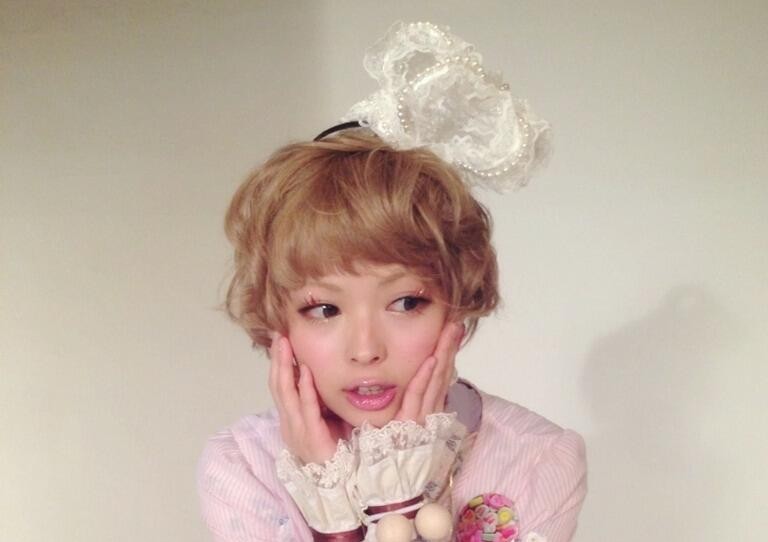
This screenshot has height=542, width=768. Identify the location of shadow on wall. (670, 350).